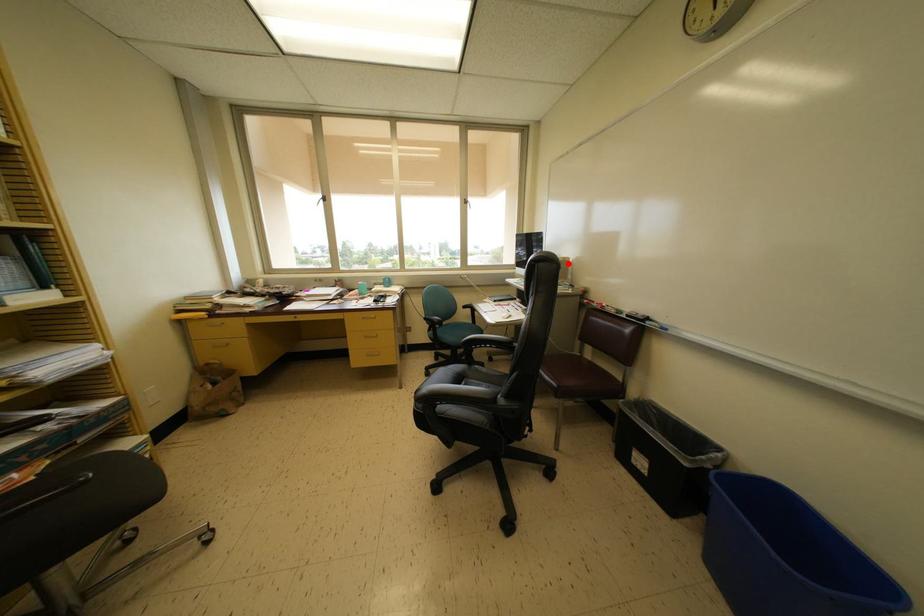
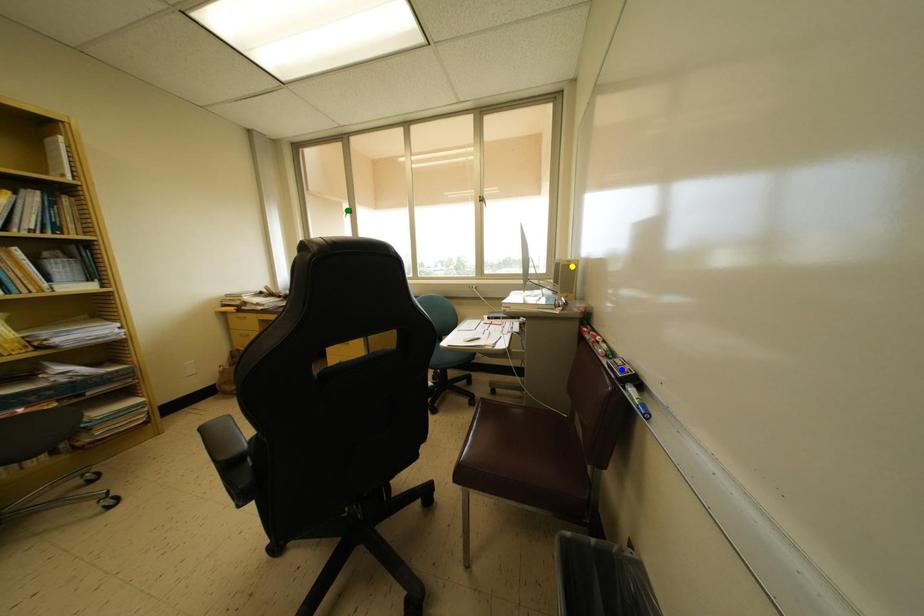
Question: I am providing you with two images of the same scene from different viewpoints. A red point is marked on the first image. You are given multiple points on the second image. Can you choose the point in image 2 that corresponds to the point in image 1?

Choices:
 (A) yellow point
 (B) blue point
 (C) green point

Answer: (A)